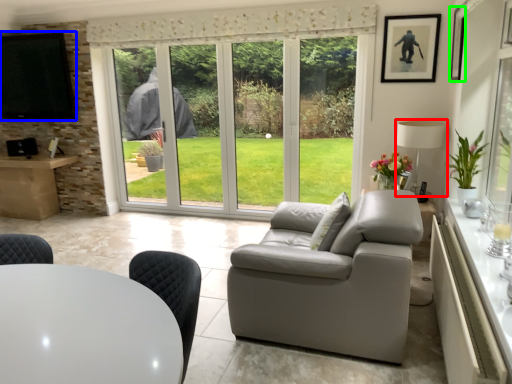
Question: Considering the real-world distances, which object is farthest from lamp (highlighted by a red box)? window screen (highlighted by a blue box) or picture frame (highlighted by a green box)?

Choices:
 (A) window screen
 (B) picture frame

Answer: (A)